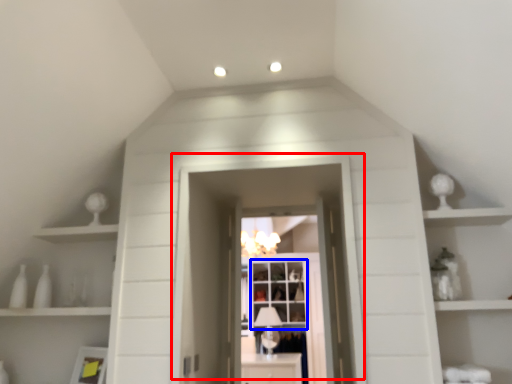
Question: Which point is closer to the camera, door (highlighted by a red box) or window (highlighted by a blue box)?

Choices:
 (A) door
 (B) window

Answer: (A)